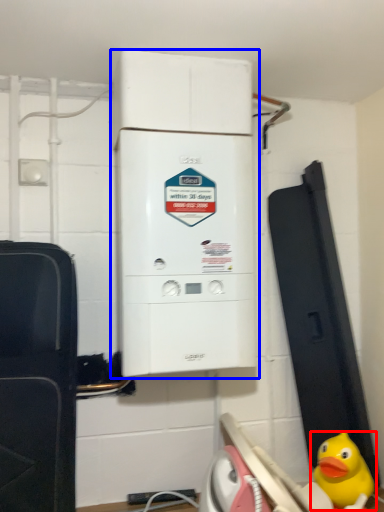
Question: Which of the following is the closest to the observer, toy (highlighted by a red box) or home appliance (highlighted by a blue box)?

Choices:
 (A) toy
 (B) home appliance

Answer: (B)